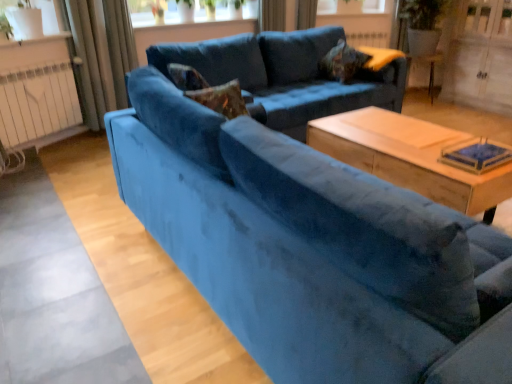
Question: Looking at their shapes, would you say white matte radiator at left is wider or thinner than velvet curtain at upper center, which is counted as the second curtain, starting from the left?

Choices:
 (A) wide
 (B) thin

Answer: (B)

Question: Does point (14, 92) appear closer or farther from the camera than point (123, 57)?

Choices:
 (A) farther
 (B) closer

Answer: (B)

Question: Which object is the farthest from the velvet curtain at left, which appears as the third curtain when viewed from the right?

Choices:
 (A) wooden coffee table at center
 (B) white matte radiator at left
 (C) velvet curtain at upper center, which is counted as the second curtain, starting from the left
 (D) clear glass window screen at upper center
 (E) white wood screen door at upper right

Answer: (E)

Question: Estimate the real-world distances between objects in this image. Which object is farther from the velvet blue couch at center, placed as the first studio couch when sorted from back to front?

Choices:
 (A) velvet textured pillow at upper center
 (B) velvet blue curtain at upper center, which is counted as the 1th curtain, starting from the right
 (C) wooden side table at right
 (D) clear glass window screen at upper center
 (E) wooden coffee table at center

Answer: (D)